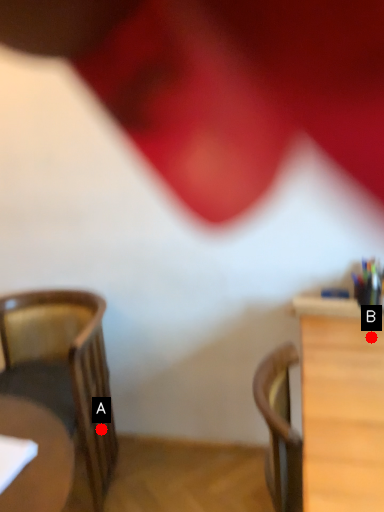
Question: Two points are circled on the image, labeled by A and B beside each circle. Which point is farther from the camera taking this photo?

Choices:
 (A) A is further
 (B) B is further

Answer: (A)